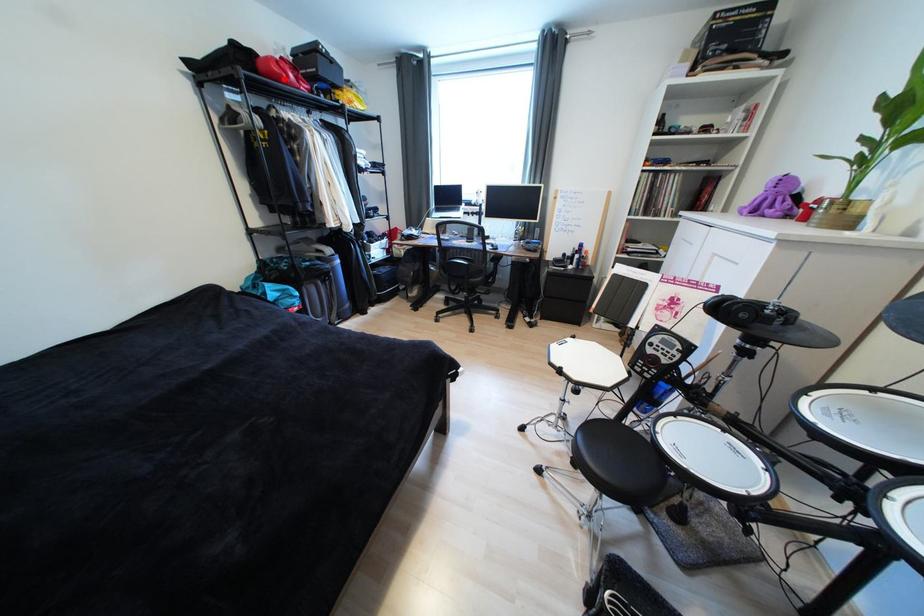
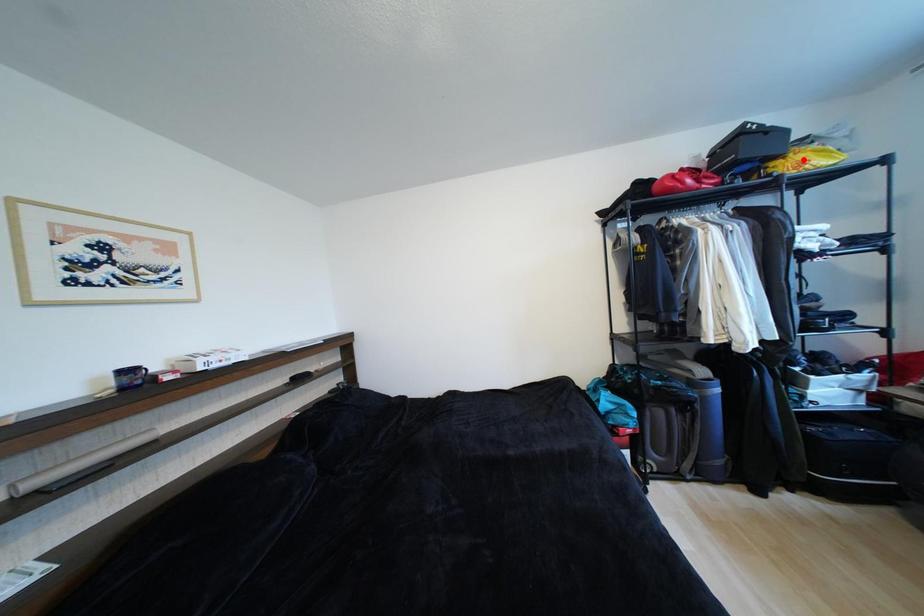
I am providing you with two images of the same scene from different viewpoints. A red point is marked on the first image and another point is marked on the second image. Are the points marked in image1 and image2 representing the same 3D position?

No